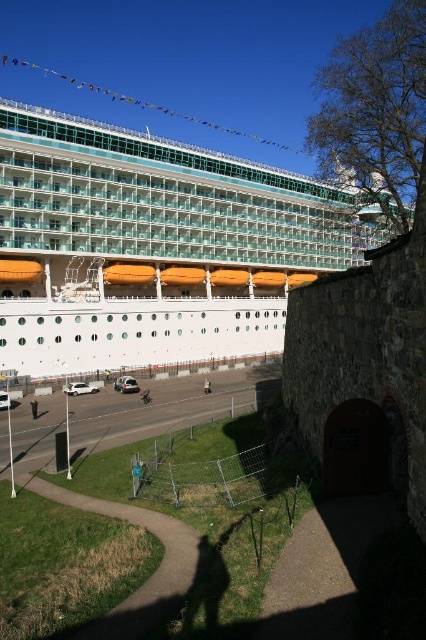
Based on the photo, you are standing on the cruise ship and want to walk to the historic stone structure. There is green grass at lower left and a light brown leather jacket at center in your path. Which object is wider so you need to step around it first?

The green grass at lower left is wider than the light brown leather jacket at center, so you need to step around the green grass at lower left first.

You are standing on the cruise ship and want to walk to the stone structure. You see the green grass at lower left and the light brown leather jacket at lower center. Which object is closer to your current position?

The green grass at lower left is closer to your current position because it is in front of the light brown leather jacket at lower center.